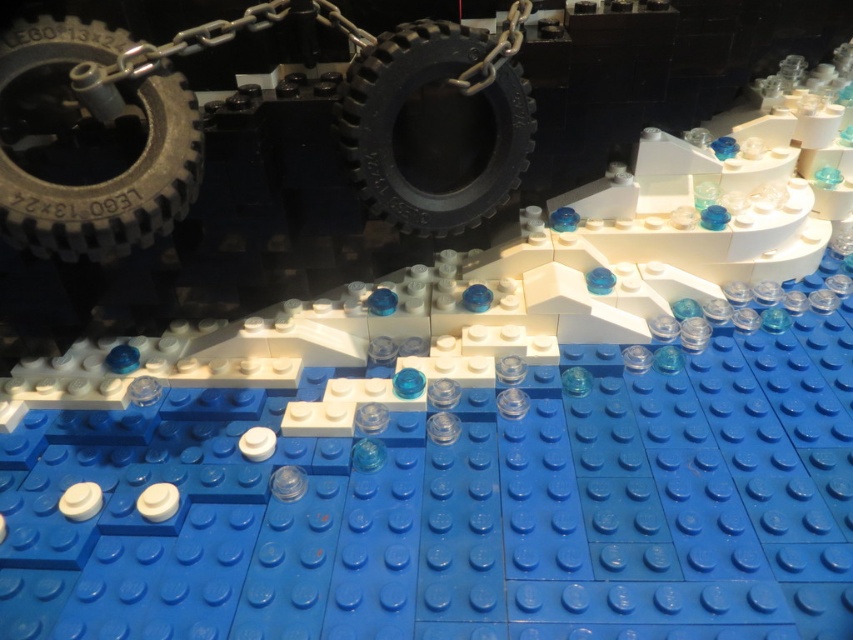
Question: Which of the following is the farthest from the observer?

Choices:
 (A) (505, 58)
 (B) (30, 177)

Answer: (A)

Question: Which of the following is the farthest from the observer?

Choices:
 (A) dark gray rubber tire at upper left
 (B) black rubber tire at center

Answer: (B)

Question: In this image, where is dark gray rubber tire at upper left located relative to black rubber tire at center?

Choices:
 (A) above
 (B) below

Answer: (B)

Question: Does dark gray rubber tire at upper left have a greater width compared to black rubber tire at center?

Choices:
 (A) yes
 (B) no

Answer: (B)

Question: Does dark gray rubber tire at upper left have a lesser width compared to black rubber tire at center?

Choices:
 (A) no
 (B) yes

Answer: (B)